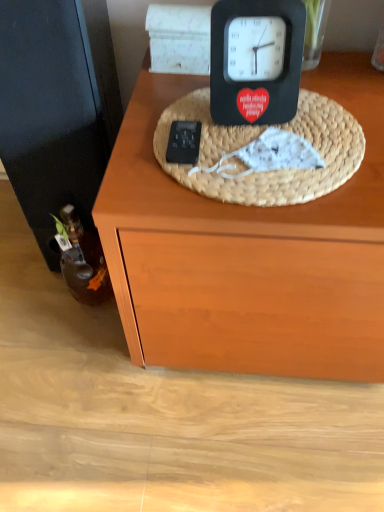
Question: Is woven straw basket at center facing towards brown glass bottle at left?

Choices:
 (A) no
 (B) yes

Answer: (A)

Question: From the image's perspective, is woven straw basket at center beneath brown glass bottle at left?

Choices:
 (A) yes
 (B) no

Answer: (B)

Question: Is woven straw basket at center far from brown glass bottle at left?

Choices:
 (A) no
 (B) yes

Answer: (A)

Question: Considering the relative positions of woven straw basket at center and brown glass bottle at left in the image provided, is woven straw basket at center to the right of brown glass bottle at left from the viewer's perspective?

Choices:
 (A) yes
 (B) no

Answer: (A)

Question: Is woven straw basket at center thinner than brown glass bottle at left?

Choices:
 (A) no
 (B) yes

Answer: (A)

Question: From a real-world perspective, relative to woven straw basket at center, is brown glass bottle at left vertically above or below?

Choices:
 (A) above
 (B) below

Answer: (B)

Question: In the image, is brown glass bottle at left positioned in front of or behind woven straw basket at center?

Choices:
 (A) front
 (B) behind

Answer: (B)

Question: In terms of height, does brown glass bottle at left look taller or shorter compared to woven straw basket at center?

Choices:
 (A) tall
 (B) short

Answer: (A)

Question: From the image's perspective, is brown glass bottle at left located above or below woven straw basket at center?

Choices:
 (A) below
 (B) above

Answer: (A)

Question: Would you say woven straw basket at center is inside or outside brown glass bottle at left?

Choices:
 (A) outside
 (B) inside

Answer: (A)

Question: From a real-world perspective, is woven straw basket at center physically located above or below brown glass bottle at left?

Choices:
 (A) above
 (B) below

Answer: (A)

Question: In the image, is woven straw basket at center on the left side or the right side of brown glass bottle at left?

Choices:
 (A) left
 (B) right

Answer: (B)

Question: Relative to brown glass bottle at left, is woven straw basket at center in front or behind?

Choices:
 (A) front
 (B) behind

Answer: (A)

Question: From the image's perspective, relative to black matte clock at upper center, is brown glass bottle at left above or below?

Choices:
 (A) above
 (B) below

Answer: (B)

Question: From a real-world perspective, is brown glass bottle at left physically located above or below black matte clock at upper center?

Choices:
 (A) above
 (B) below

Answer: (B)